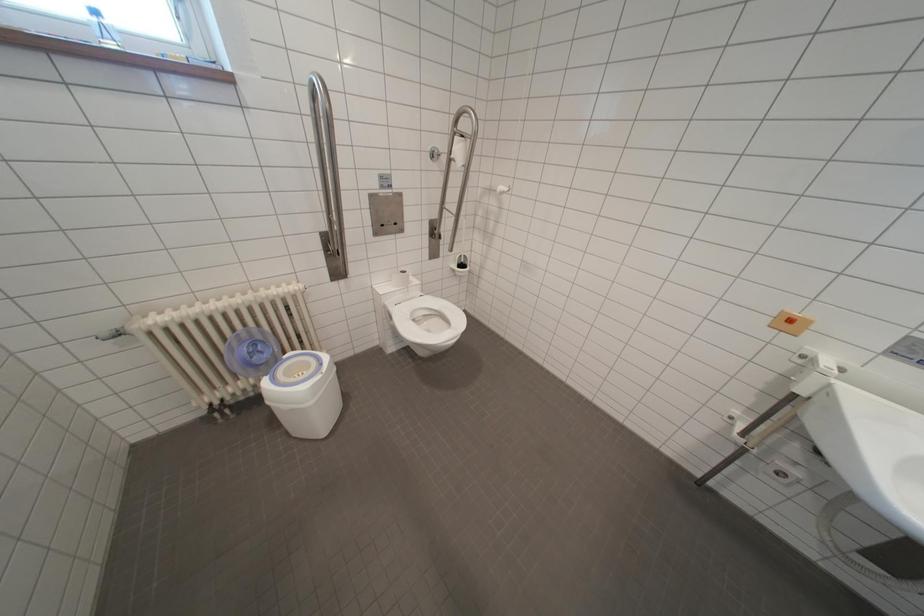
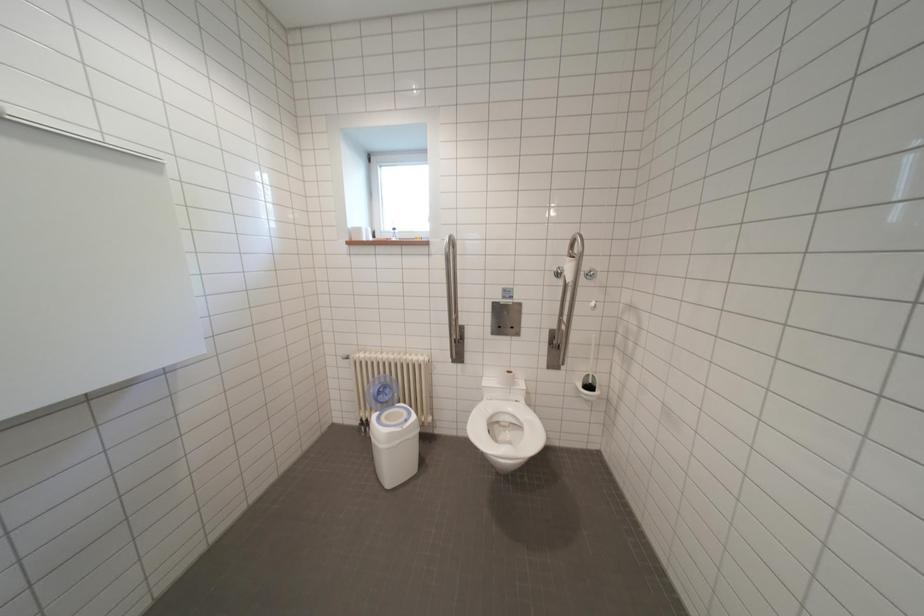
Question: The camera is either moving clockwise (left) or counter-clockwise (right) around the object. The first image is from the beginning of the video and the second image is from the end. Is the camera moving left or right when shooting the video?

Choices:
 (A) Left
 (B) Right

Answer: (B)